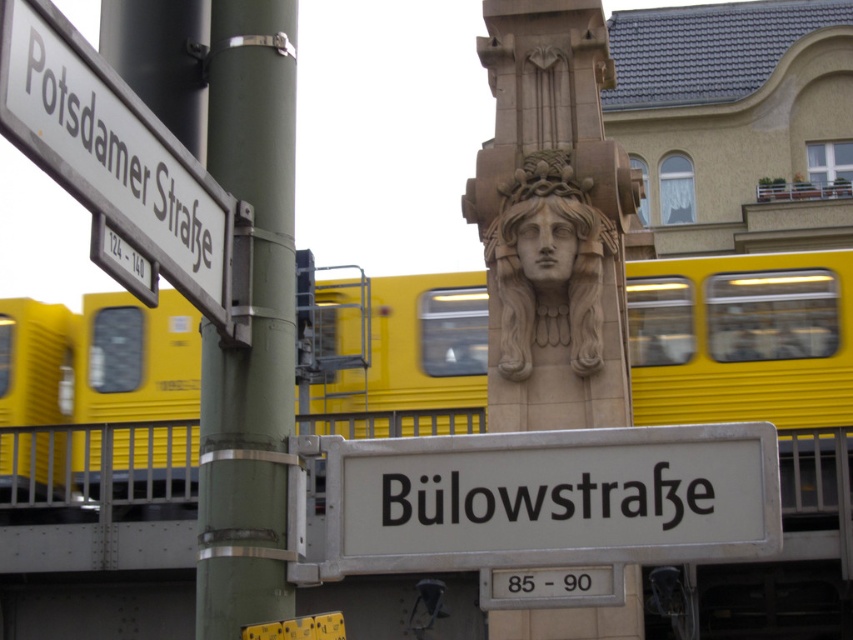
You are a photographer trying to capture both the yellow matte train at center and the white metallic sign at center in a single shot. Based on their sizes, which object should you focus on first to ensure they both fit in the frame?

The yellow matte train at center is much taller than the white metallic sign at center, so you should focus on framing the taller train first to ensure both objects fit in the shot.

You are standing at the intersection looking at the two street signs mounted on the green pole. There are two points marked on the pole at coordinates point (328, 321) and point (573, 369). Which point is closer to you?

Point (573, 369) is closer to you because it is in front of point (328, 321).

Consider the image. You are standing at the intersection where the two street signs are mounted on the green pole. You notice two points marked on the ground at coordinates point [473,460] and point [234,460]. If you were to walk towards the yellow train passing by on the elevated track, which point would you pass over first?

Since point [473,460] is behind point [234,460], you would first pass over point [234,460] before reaching point [473,460] when walking towards the yellow train on the elevated track.